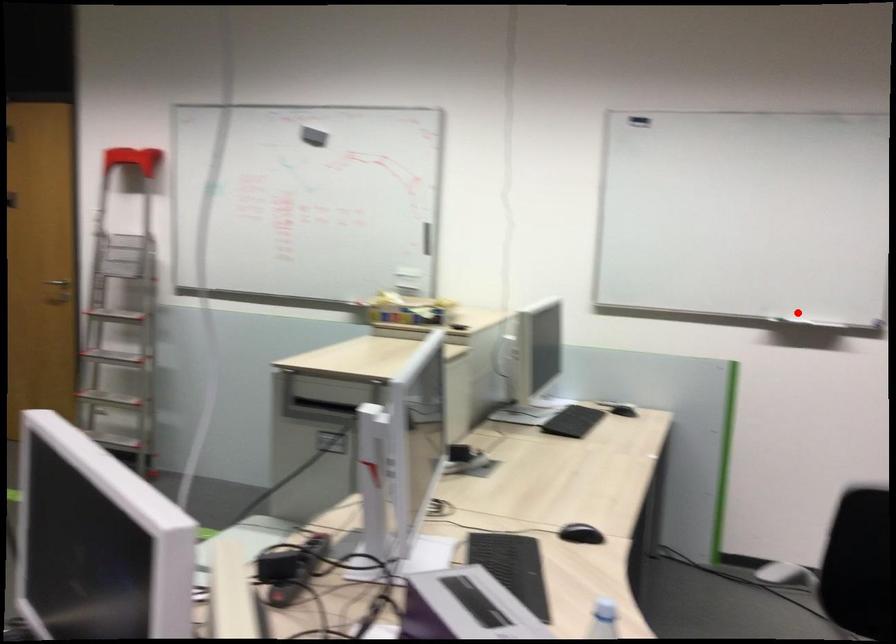
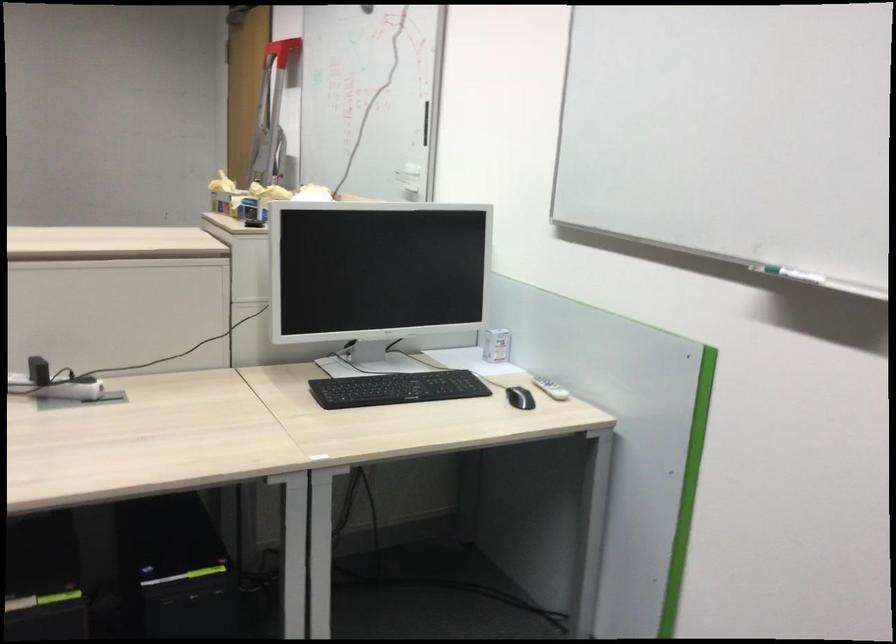
Question: I am providing you with two images of the same scene from different viewpoints. Image1 has a red point marked. In image2, the corresponding 3D location appears at what relative position? Reply with the corresponding letter.

Choices:
 (A) Closer
 (B) Farther

Answer: (A)